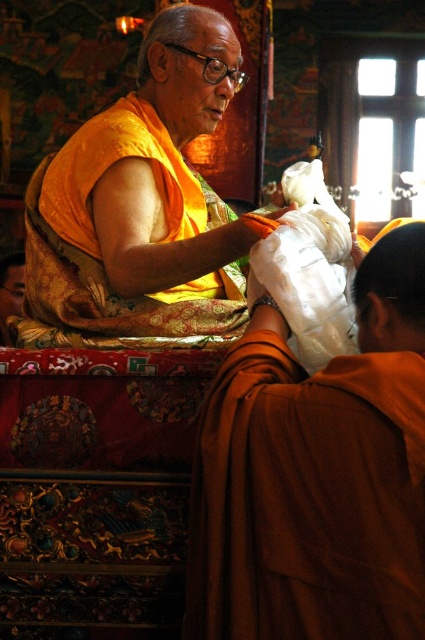
Question: Can you confirm if orange silk robe at center is positioned to the right of matte orange robe at center?

Choices:
 (A) yes
 (B) no

Answer: (A)

Question: Which point is closer to the camera?

Choices:
 (A) orange silk robe at center
 (B) matte orange robe at center

Answer: (A)

Question: Is orange silk robe at center to the right of matte orange robe at center from the viewer's perspective?

Choices:
 (A) yes
 (B) no

Answer: (A)

Question: Which of the following is the closest to the observer?

Choices:
 (A) (322, 396)
 (B) (206, 120)

Answer: (A)

Question: In this image, where is orange silk robe at center located relative to matte orange robe at center?

Choices:
 (A) right
 (B) left

Answer: (A)